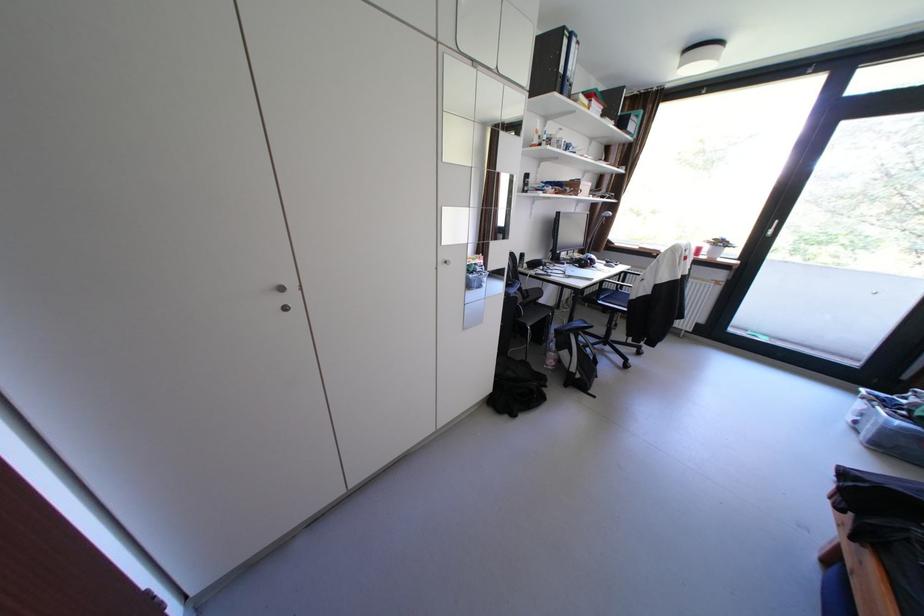
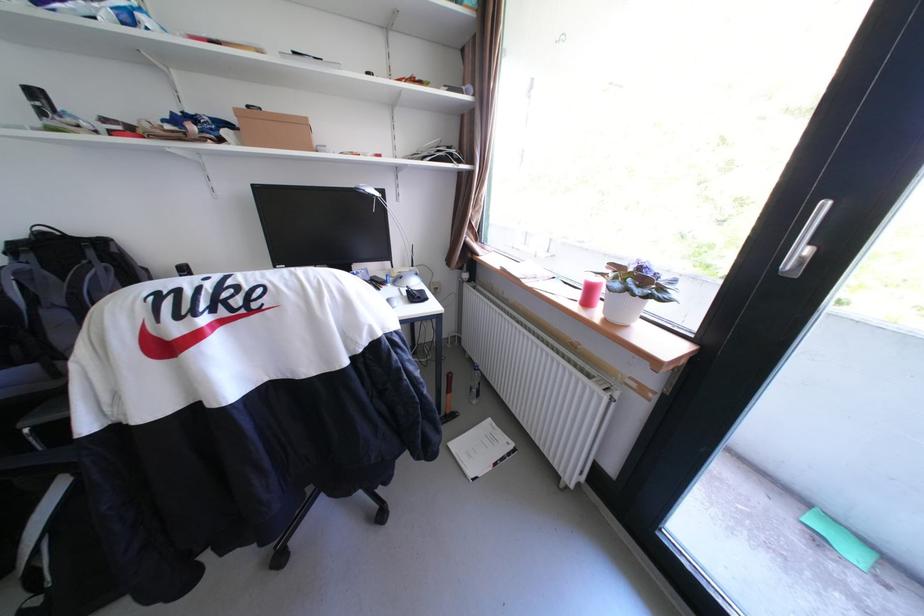
Which direction would the cameraman need to move to produce the second image?

The cameraman moved toward right, forward.